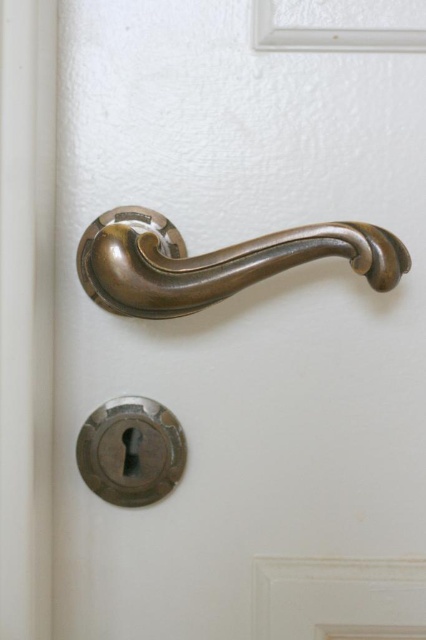
Question: Is bronze polished door handle at center closer to camera compared to matte silver keyhole at lower center?

Choices:
 (A) yes
 (B) no

Answer: (A)

Question: Is bronze polished door handle at center smaller than matte silver keyhole at lower center?

Choices:
 (A) no
 (B) yes

Answer: (A)

Question: Which point is farther from the camera taking this photo?

Choices:
 (A) (158, 496)
 (B) (91, 269)

Answer: (A)

Question: Can you confirm if bronze polished door handle at center is positioned below matte silver keyhole at lower center?

Choices:
 (A) no
 (B) yes

Answer: (A)

Question: Among these objects, which one is farthest from the camera?

Choices:
 (A) bronze polished door handle at center
 (B) matte silver keyhole at lower center

Answer: (B)

Question: Which of the following is the farthest from the observer?

Choices:
 (A) (379, 262)
 (B) (92, 424)

Answer: (B)